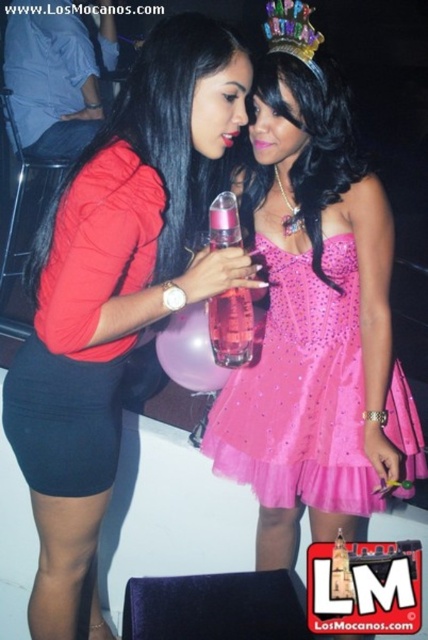
Question: Which point is farther from the camera taking this photo?

Choices:
 (A) 74,376
 (B) 231,243
 (C) 270,106

Answer: (A)

Question: Does pink tulle dress at center have a larger size compared to pink glass bottle at center?

Choices:
 (A) no
 (B) yes

Answer: (B)

Question: Can you confirm if pink satin dress at center is positioned to the left of pink tulle dress at center?

Choices:
 (A) no
 (B) yes

Answer: (A)

Question: Is pink satin dress at center to the left of matte black dress at center from the viewer's perspective?

Choices:
 (A) no
 (B) yes

Answer: (A)

Question: Which of the following is the farthest from the observer?

Choices:
 (A) pink satin dress at center
 (B) matte black dress at center
 (C) pink glass bottle at center

Answer: (C)

Question: Among these points, which one is nearest to the camera?

Choices:
 (A) (228, 388)
 (B) (64, 604)
 (C) (240, 237)
 (D) (353, 280)

Answer: (C)